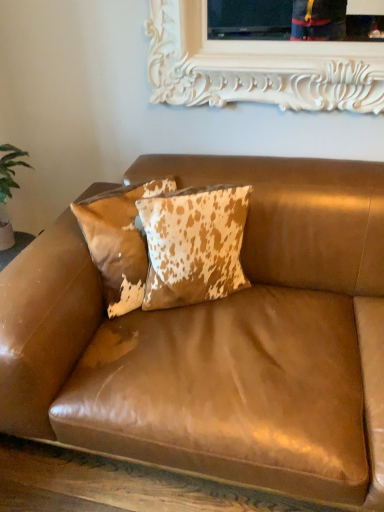
Identify the location of cowhide pillow at center, the second pillow viewed from the left. (194, 245).

Where is `brown leather couch at center`? The width and height of the screenshot is (384, 512). brown leather couch at center is located at coordinates (220, 341).

What are the coordinates of `cowhide pillow at center, which is the 1th pillow from right to left` in the screenshot? It's located at (194, 245).

Considering the relative sizes of cowhide pillow at center, which is the 1th pillow from right to left, and cowhide pillow at center, the first pillow in the left-to-right sequence, in the image provided, is cowhide pillow at center, which is the 1th pillow from right to left, thinner than cowhide pillow at center, the first pillow in the left-to-right sequence,?

Indeed, cowhide pillow at center, which is the 1th pillow from right to left, has a lesser width compared to cowhide pillow at center, the first pillow in the left-to-right sequence.

Does point (186, 232) come behind point (92, 219)?

No, (186, 232) is closer to viewer.

Identify the location of pillow located behind the cowhide pillow at center, the second pillow viewed from the left. (119, 241).

Is cowhide pillow at center, which is the 1th pillow from right to left, oriented towards cowhide pillow at center, the first pillow in the left-to-right sequence?

No, cowhide pillow at center, which is the 1th pillow from right to left, does not turn towards cowhide pillow at center, the first pillow in the left-to-right sequence.

The image size is (384, 512). Identify the location of studio couch located underneath the cowhide pillow at center, which is the 1th pillow from right to left (from a real-world perspective). (220, 341).

Which is correct: brown leather couch at center is inside cowhide pillow at center, the second pillow viewed from the left, or outside of it?

The correct answer is: outside.

Between brown leather couch at center and cowhide pillow at center, the second pillow viewed from the left, which one is positioned behind?

cowhide pillow at center, the second pillow viewed from the left, is further from the camera.

From a real-world perspective, is brown leather couch at center above or below cowhide pillow at center, which is the 1th pillow from right to left?

In terms of real-world spatial position, brown leather couch at center is below cowhide pillow at center, which is the 1th pillow from right to left.

Which object is thinner, cowhide pillow at center, positioned as the second pillow in right-to-left order, or cowhide pillow at center, which is the 1th pillow from right to left?

With smaller width is cowhide pillow at center, which is the 1th pillow from right to left.

Can you confirm if cowhide pillow at center, the first pillow in the left-to-right sequence, is smaller than cowhide pillow at center, the second pillow viewed from the left?

No, cowhide pillow at center, the first pillow in the left-to-right sequence, is not smaller than cowhide pillow at center, the second pillow viewed from the left.

Which is further, (114,216) or (157,285)?

The point (157,285) is farther.

Consider the image. Is cowhide pillow at center, positioned as the second pillow in right-to-left order, wider than brown leather couch at center?

No.

From the image's perspective, is cowhide pillow at center, positioned as the second pillow in right-to-left order, above brown leather couch at center?

Yes, from the image's perspective, cowhide pillow at center, positioned as the second pillow in right-to-left order, is over brown leather couch at center.

Which of these two, cowhide pillow at center, positioned as the second pillow in right-to-left order, or brown leather couch at center, is smaller?

With smaller size is cowhide pillow at center, positioned as the second pillow in right-to-left order.

Which is more to the left, cowhide pillow at center, positioned as the second pillow in right-to-left order, or brown leather couch at center?

cowhide pillow at center, positioned as the second pillow in right-to-left order.

Can you confirm if brown leather couch at center is bigger than cowhide pillow at center, the first pillow in the left-to-right sequence?

Yes.

Does brown leather couch at center lie behind cowhide pillow at center, the first pillow in the left-to-right sequence?

No, it is not.

Looking at this image, is brown leather couch at center to the left of cowhide pillow at center, the first pillow in the left-to-right sequence, from the viewer's perspective?

Incorrect, brown leather couch at center is not on the left side of cowhide pillow at center, the first pillow in the left-to-right sequence.

From the image's perspective, does brown leather couch at center appear lower than cowhide pillow at center, positioned as the second pillow in right-to-left order?

Yes.

From the picture: From a real-world perspective, between cowhide pillow at center, the second pillow viewed from the left, and brown leather couch at center, who is vertically lower?

In real-world perspective, brown leather couch at center is lower.

Looking at this image, which of these two, cowhide pillow at center, the second pillow viewed from the left, or brown leather couch at center, stands taller?

Standing taller between the two is brown leather couch at center.

Which point is more distant from viewer, (151, 241) or (281, 240)?

The point (281, 240) is more distant.

Is cowhide pillow at center, which is the 1th pillow from right to left, not near brown leather couch at center?

They are positioned close to each other.

This screenshot has height=512, width=384. What are the coordinates of `pillow located underneath the cowhide pillow at center, which is the 1th pillow from right to left (from a real-world perspective)` in the screenshot? It's located at (119, 241).

Identify the location of studio couch that is in front of the cowhide pillow at center, the second pillow viewed from the left. (220, 341).

Estimate the real-world distances between objects in this image. Which object is closer to cowhide pillow at center, which is the 1th pillow from right to left, brown leather couch at center or cowhide pillow at center, the first pillow in the left-to-right sequence?

The object closer to cowhide pillow at center, which is the 1th pillow from right to left, is cowhide pillow at center, the first pillow in the left-to-right sequence.

Considering their positions, is cowhide pillow at center, the first pillow in the left-to-right sequence, positioned further to brown leather couch at center than cowhide pillow at center, which is the 1th pillow from right to left?

cowhide pillow at center, the first pillow in the left-to-right sequence, lies further to brown leather couch at center than the other object.

Considering their positions, is cowhide pillow at center, which is the 1th pillow from right to left, positioned closer to brown leather couch at center than cowhide pillow at center, the first pillow in the left-to-right sequence?

cowhide pillow at center, which is the 1th pillow from right to left, lies closer to brown leather couch at center than the other object.

Considering their positions, is brown leather couch at center positioned closer to cowhide pillow at center, the first pillow in the left-to-right sequence, than cowhide pillow at center, the second pillow viewed from the left?

cowhide pillow at center, the second pillow viewed from the left, is closer to cowhide pillow at center, the first pillow in the left-to-right sequence.

From the image, which object appears to be nearer to cowhide pillow at center, positioned as the second pillow in right-to-left order, cowhide pillow at center, which is the 1th pillow from right to left, or brown leather couch at center?

The object closer to cowhide pillow at center, positioned as the second pillow in right-to-left order, is cowhide pillow at center, which is the 1th pillow from right to left.

From the image, which object appears to be nearer to cowhide pillow at center, the second pillow viewed from the left, cowhide pillow at center, positioned as the second pillow in right-to-left order, or brown leather couch at center?

cowhide pillow at center, positioned as the second pillow in right-to-left order.

At what (x,y) coordinates should I click in order to perform the action: click on pillow between brown leather couch at center and cowhide pillow at center, the first pillow in the left-to-right sequence, from front to back. Please return your answer as a coordinate pair (x, y). Image resolution: width=384 pixels, height=512 pixels. Looking at the image, I should click on (194, 245).